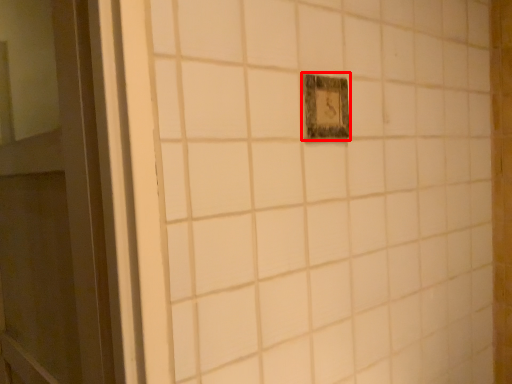
Question: Where is light switch (annotated by the red box) located in relation to door in the image?

Choices:
 (A) right
 (B) left

Answer: (A)